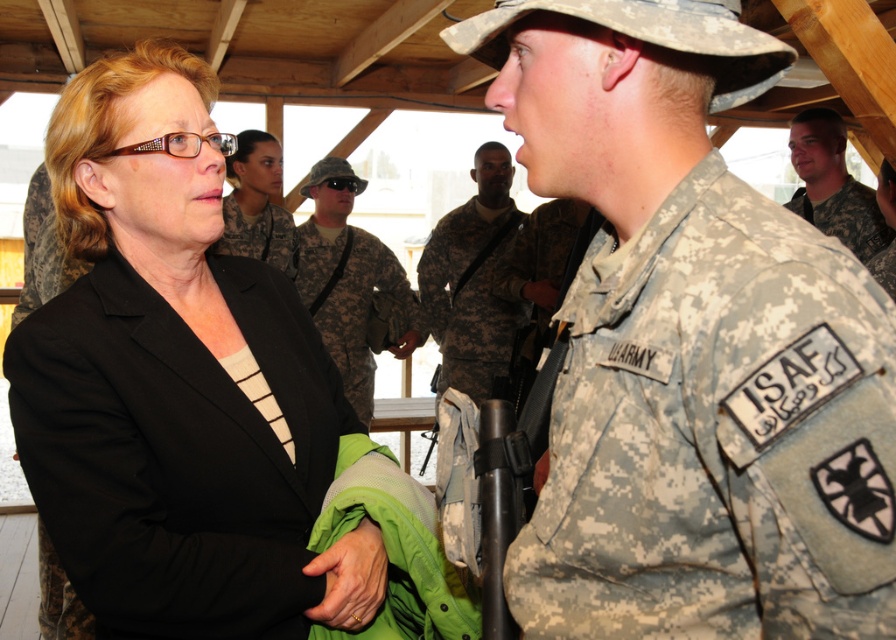
You are a photographer standing at the center of the scene. You want to take a photo of both the point at coordinates point [798,116] and point [235,241]. Which point is closer to the camera so that it can be in focus without moving the camera?

Point [235,241] is closer to the camera than point [798,116], so it will be in focus first.